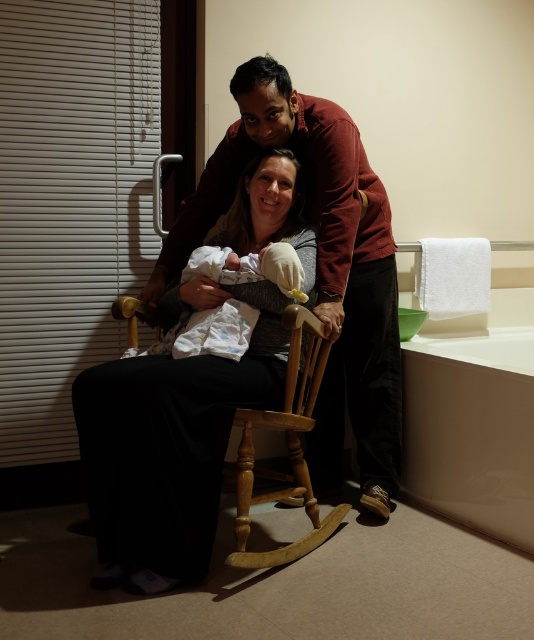
You are a nurse preparing to place a small medical kit on the surface of the matte brown rocking chair at center. However, you notice the white soft cloth at center is already placed there. Based on their sizes, can the medical kit and the cloth both fit on the chair?

The matte brown rocking chair at center has a larger size compared to white soft cloth at center. Since the chair is bigger, there should be enough space to place both the medical kit and the cloth on it.

You are a nurse standing 6 feet away from the matte brown rocking chair at center. Can you reach the baby in the rocking chair without moving closer?

The matte brown rocking chair at center is 5.97 feet away from the viewer, so the nurse can reach the baby without moving closer since the distance is slightly less than 6 feet.

You are a nurse in the hospital room and need to place a small medical kit on either the matte brown rocking chair at center or the white soft cloth at center. Which surface has a larger width to accommodate the kit?

The matte brown rocking chair at center has a larger width than the white soft cloth at center, so it is better to place the medical kit there.